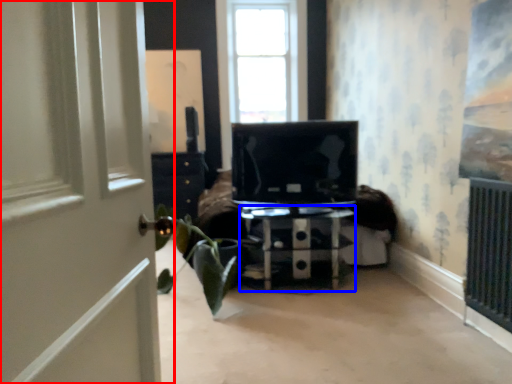
Question: Which object appears closest to the camera in this image, door (highlighted by a red box) or furniture (highlighted by a blue box)?

Choices:
 (A) door
 (B) furniture

Answer: (A)